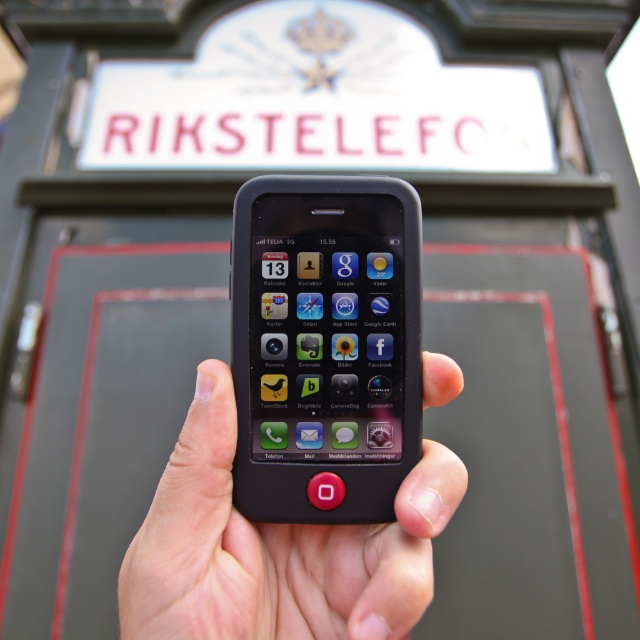
You are trying to place a sticker on your black matte smartphone at center. The sticker requires a minimum of 1.2 cm of space from the top edge of the phone. Given that the phone has a screen height of 14.5 cm, can you determine if the sticker will fit without overlapping the top edge?

The black matte smartphone at center has a screen height of 14.5 cm. The sticker requires 1.2 cm of space from the top edge. Since 1.2 cm is less than the total screen height, the sticker can be placed within the available space without overlapping the top edge.

From the picture: You are a photographer trying to capture both the black matte smartphone at center and the black matte phone at center in a single shot. Which one will appear larger in your photo?

The black matte smartphone at center will appear larger in your photo because it is closer to the viewer than the black matte phone at center.

You are trying to determine which device is smaller between the black matte smartphone at center and the black matte phone at center. Based on the scene, which one takes up less space in the image?

The black matte smartphone at center occupies less space than the black matte phone at center, so it takes up less space in the image.